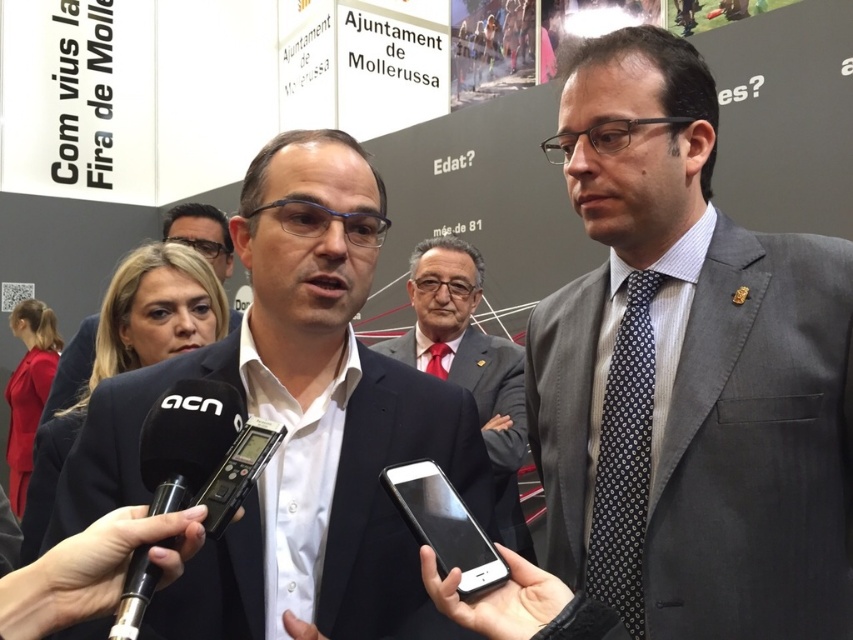
Question: Based on their relative distances, which object is farther from the matte black suit at center?

Choices:
 (A) gray wool suit at right
 (B) white shirt at center
 (C) dark gray suit at center

Answer: (C)

Question: Where is gray wool suit at right located in relation to white shirt at center in the image?

Choices:
 (A) below
 (B) above

Answer: (A)

Question: Is gray wool suit at right closer to the viewer compared to white shirt at center?

Choices:
 (A) yes
 (B) no

Answer: (A)

Question: Can you confirm if gray wool suit at right is positioned to the right of matte black suit at center?

Choices:
 (A) yes
 (B) no

Answer: (A)

Question: Which point is closer to the camera?

Choices:
 (A) gray wool suit at right
 (B) matte black suit at center
 (C) white shirt at center

Answer: (B)

Question: Which point is closer to the camera?

Choices:
 (A) 473,380
 (B) 676,420

Answer: (B)